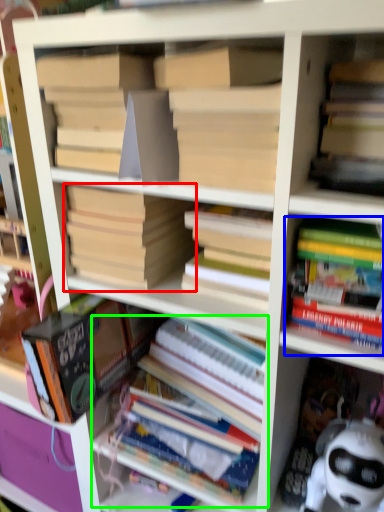
Question: Which object is positioned closest to book (highlighted by a red box)? Select from book (highlighted by a blue box) and book (highlighted by a green box).

Choices:
 (A) book
 (B) book

Answer: (A)